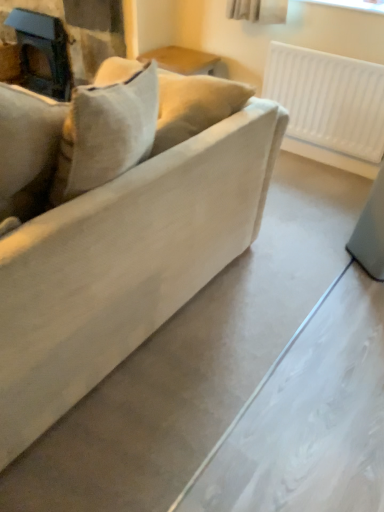
Question: Does white plastic radiator at upper right appear on the right side of matte beige couch at center?

Choices:
 (A) yes
 (B) no

Answer: (A)

Question: Is white plastic radiator at upper right next to matte beige couch at center and touching it?

Choices:
 (A) no
 (B) yes

Answer: (A)

Question: Would you say white plastic radiator at upper right is a long distance from matte beige couch at center?

Choices:
 (A) yes
 (B) no

Answer: (A)

Question: Would you say matte beige couch at center is part of white plastic radiator at upper right's contents?

Choices:
 (A) yes
 (B) no

Answer: (B)

Question: Is white plastic radiator at upper right facing away from matte beige couch at center?

Choices:
 (A) yes
 (B) no

Answer: (B)

Question: Does white plastic radiator at upper right have a lesser height compared to matte beige couch at center?

Choices:
 (A) yes
 (B) no

Answer: (A)

Question: Is matte black fireplace at upper left positioned beyond the bounds of matte beige couch at center?

Choices:
 (A) yes
 (B) no

Answer: (A)

Question: Is matte black fireplace at upper left at the left side of matte beige couch at center?

Choices:
 (A) yes
 (B) no

Answer: (A)

Question: From the image's perspective, is matte black fireplace at upper left below matte beige couch at center?

Choices:
 (A) no
 (B) yes

Answer: (A)

Question: From the image's perspective, is matte black fireplace at upper left on top of matte beige couch at center?

Choices:
 (A) no
 (B) yes

Answer: (B)

Question: From a real-world perspective, is matte black fireplace at upper left positioned over matte beige couch at center based on gravity?

Choices:
 (A) yes
 (B) no

Answer: (B)

Question: Is matte black fireplace at upper left next to matte beige couch at center and touching it?

Choices:
 (A) yes
 (B) no

Answer: (B)

Question: From a real-world perspective, is matte beige couch at center physically below matte black fireplace at upper left?

Choices:
 (A) yes
 (B) no

Answer: (B)